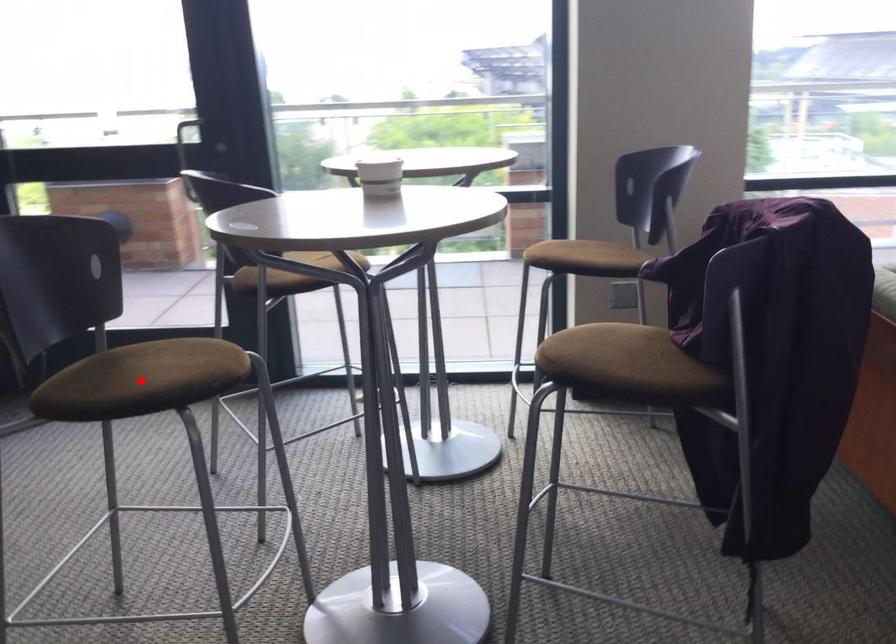
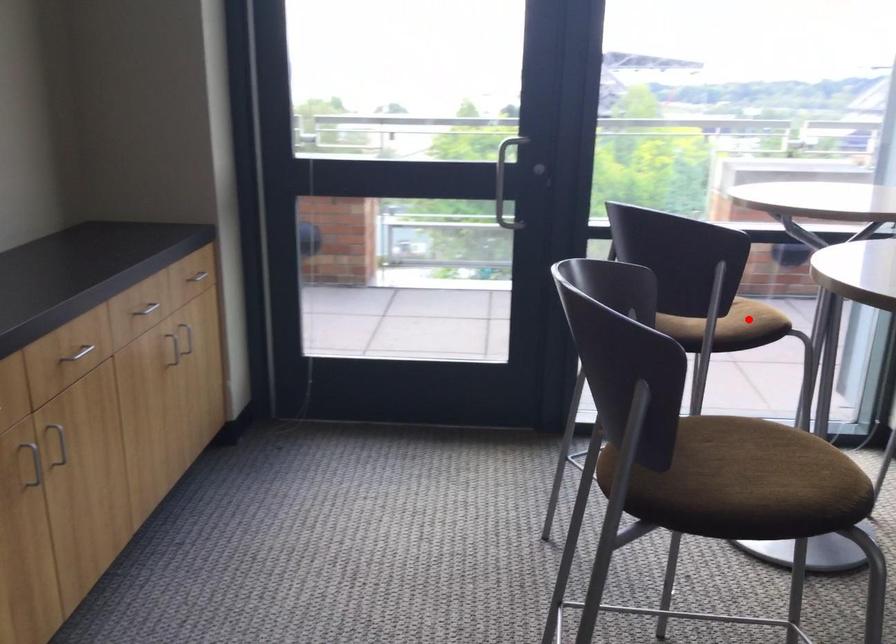
I am providing you with two images of the same scene from different viewpoints. A red point is marked on the first image and another point is marked on the second image. Is the red point in image1 aligned with the point shown in image2?

No